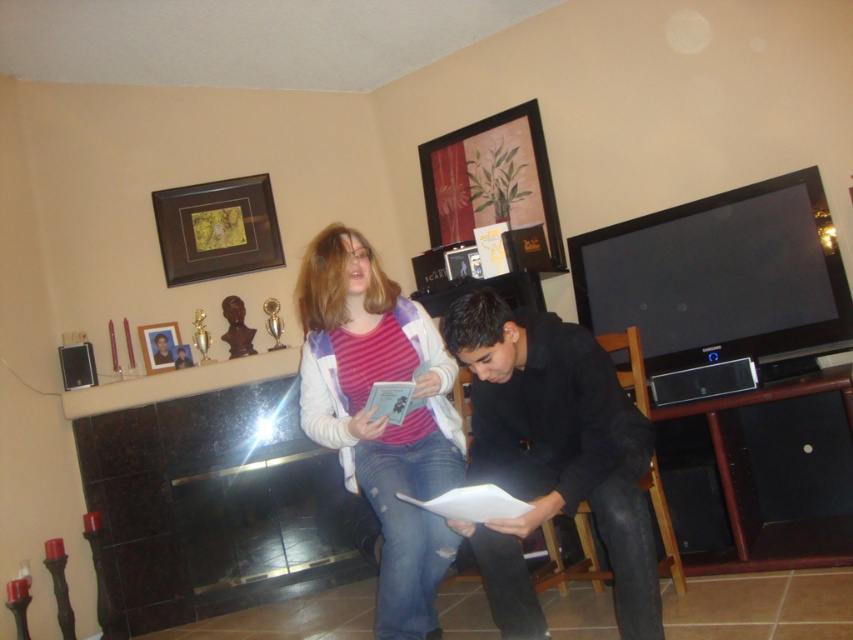
The image size is (853, 640). What do you see at coordinates (552, 456) in the screenshot?
I see `black matte shirt at center` at bounding box center [552, 456].

The width and height of the screenshot is (853, 640). Identify the location of black matte shirt at center. (552, 456).

Is brown wooden picture frame at upper left positioned before wooden photo frame at upper left?

That is False.

Image resolution: width=853 pixels, height=640 pixels. What do you see at coordinates (216, 228) in the screenshot? I see `brown wooden picture frame at upper left` at bounding box center [216, 228].

Find the location of `brown wooden picture frame at upper left`. brown wooden picture frame at upper left is located at coordinates (216, 228).

Is matte wooden picture frame at upper center closer to the viewer compared to wooden photo frame at upper left?

That is True.

Between point (440, 148) and point (163, 355), which one is positioned behind?

The point (440, 148) is more distant.

This screenshot has width=853, height=640. What are the coordinates of `matte wooden picture frame at upper center` in the screenshot? It's located at (490, 179).